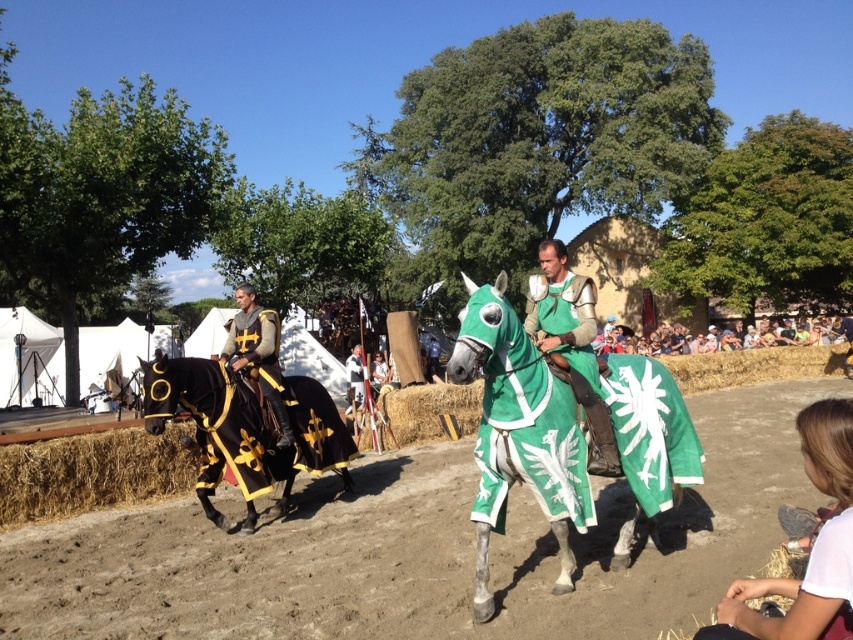
Is white cotton shirt at lower right behind green matte armor at center?

No, white cotton shirt at lower right is closer to the viewer.

Which is in front, point (801, 452) or point (534, 314)?

Point (534, 314) is in front.

I want to click on white cotton shirt at lower right, so click(x=811, y=548).

Is dirt field at center shorter than white cotton shirt at lower right?

No.

Identify the location of dirt field at center. This screenshot has height=640, width=853. (416, 548).

Between point (299, 547) and point (770, 595), which one is positioned in front?

Point (770, 595) is in front.

Where is `dirt field at center`? The width and height of the screenshot is (853, 640). dirt field at center is located at coordinates (416, 548).

Does green fabric horse at center have a larger size compared to black velvet armor at center?

Yes, green fabric horse at center is bigger than black velvet armor at center.

Does green fabric horse at center lie in front of black velvet armor at center?

That is True.

Does point (645, 490) come in front of point (236, 326)?

Yes, it is.

Where is `green fabric horse at center`? green fabric horse at center is located at coordinates (519, 432).